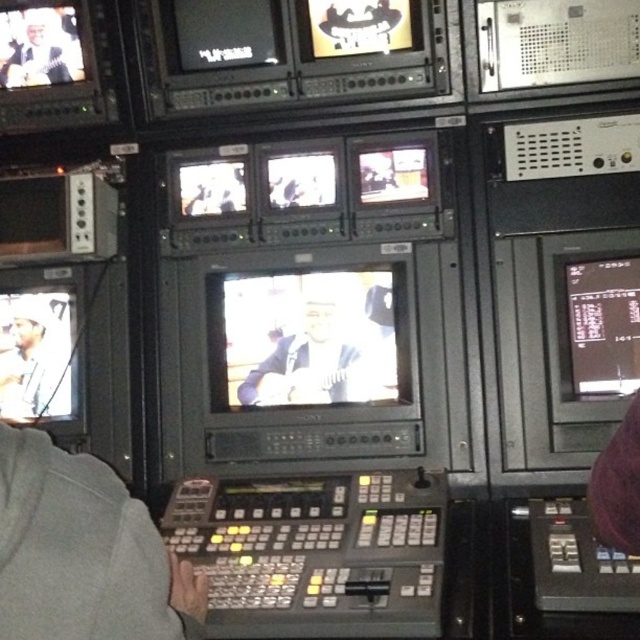
Which is in front, point (326, 342) or point (42, 68)?

Point (326, 342) is in front.

Between matte black guitar at center and matte black guitar at upper left, which one has less height?

With less height is matte black guitar at upper left.

Is point (317, 397) farther from viewer compared to point (3, 80)?

No, (317, 397) is in front of (3, 80).

You are a GUI agent. You are given a task and a screenshot of the screen. Output one action in this format:
    pyautogui.click(x=<x>, y=<y>)
    Task: Click on the matte black guitar at center
    This screenshot has width=640, height=640.
    Given the screenshot: What is the action you would take?
    [x=328, y=358]

Does black glossy monitor at right have a greater width compared to matte black guitar at left?

Incorrect, black glossy monitor at right's width does not surpass matte black guitar at left's.

Between black glossy monitor at right and matte black guitar at left, which one has more height?

With more height is black glossy monitor at right.

This screenshot has width=640, height=640. Identify the location of black glossy monitor at right. (604, 324).

Locate an element on the screen. black glossy monitor at right is located at coordinates (604, 324).

Does point (317, 368) lie in front of point (579, 381)?

No, (317, 368) is behind (579, 381).

Does matte black guitar at center have a lesser height compared to black glossy monitor at right?

Indeed, matte black guitar at center has a lesser height compared to black glossy monitor at right.

Identify the location of matte black guitar at center. The height and width of the screenshot is (640, 640). (328, 358).